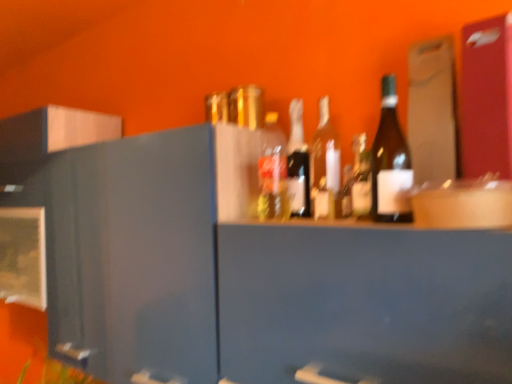
Question: Considering the relative positions of translucent glass bottle at center, arranged as the 1th bottle when viewed from the back, and matte glass bottle at center, positioned as the 2th bottle in front-to-back order, in the image provided, is translucent glass bottle at center, arranged as the 1th bottle when viewed from the back, behind matte glass bottle at center, positioned as the 2th bottle in front-to-back order,?

Choices:
 (A) no
 (B) yes

Answer: (B)

Question: Is translucent glass bottle at center, the 6th bottle when ordered from front to back, far away from matte glass bottle at center, positioned as the fifth bottle in back-to-front order?

Choices:
 (A) yes
 (B) no

Answer: (B)

Question: From the image's perspective, would you say translucent glass bottle at center, arranged as the 1th bottle when viewed from the back, is shown under matte glass bottle at center, positioned as the 2th bottle in front-to-back order?

Choices:
 (A) no
 (B) yes

Answer: (A)

Question: Is translucent glass bottle at center, the 6th bottle when ordered from front to back, at the right side of matte glass bottle at center, positioned as the 2th bottle in front-to-back order?

Choices:
 (A) yes
 (B) no

Answer: (B)

Question: Does translucent glass bottle at center, arranged as the 1th bottle when viewed from the back, have a greater width compared to matte glass bottle at center, positioned as the fifth bottle in back-to-front order?

Choices:
 (A) no
 (B) yes

Answer: (B)

Question: Does point (286, 172) appear closer or farther from the camera than point (362, 160)?

Choices:
 (A) closer
 (B) farther

Answer: (B)

Question: Do you think translucent glass bottle at center, the 2th bottle in the back-to-front sequence, is within matte glass bottle at center, positioned as the fifth bottle in back-to-front order, or outside of it?

Choices:
 (A) outside
 (B) inside

Answer: (A)

Question: In the image, is translucent glass bottle at center, the 2th bottle in the back-to-front sequence, positioned in front of or behind matte glass bottle at center, positioned as the fifth bottle in back-to-front order?

Choices:
 (A) front
 (B) behind

Answer: (B)

Question: Looking at the image, does translucent glass bottle at center, placed as the 5th bottle when sorted from front to back, seem bigger or smaller compared to matte glass bottle at center, positioned as the 2th bottle in front-to-back order?

Choices:
 (A) big
 (B) small

Answer: (A)

Question: From the image's perspective, is translucent glass bottle at center, placed as the 3th bottle when sorted from back to front, above or below matte glass bottle at center, which is the fourth bottle from back to front?

Choices:
 (A) above
 (B) below

Answer: (A)

Question: From their relative heights in the image, would you say translucent glass bottle at center, placed as the 3th bottle when sorted from back to front, is taller or shorter than matte glass bottle at center, which is the fourth bottle from back to front?

Choices:
 (A) tall
 (B) short

Answer: (A)

Question: From a real-world perspective, relative to matte glass bottle at center, which is the fourth bottle from back to front, is translucent glass bottle at center, which is counted as the 4th bottle, starting from the front, vertically above or below?

Choices:
 (A) above
 (B) below

Answer: (A)

Question: Considering the positions of point (312, 155) and point (353, 198), is point (312, 155) closer or farther from the camera than point (353, 198)?

Choices:
 (A) closer
 (B) farther

Answer: (B)

Question: Is translucent glass bottle at center, placed as the 5th bottle when sorted from front to back, taller or shorter than translucent glass bottle at center, the 6th bottle when ordered from front to back?

Choices:
 (A) short
 (B) tall

Answer: (A)

Question: From a real-world perspective, is translucent glass bottle at center, placed as the 5th bottle when sorted from front to back, above or below translucent glass bottle at center, the 6th bottle when ordered from front to back?

Choices:
 (A) below
 (B) above

Answer: (A)